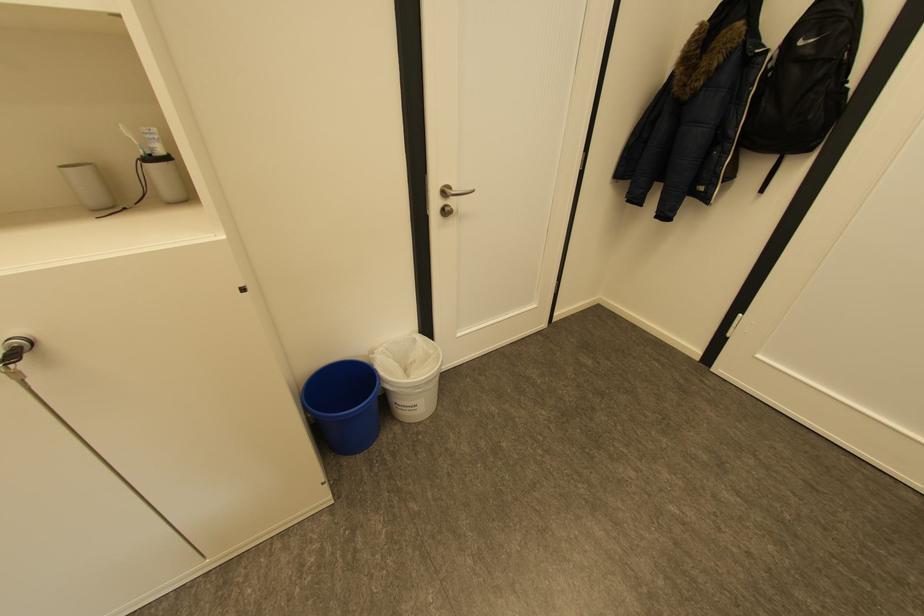
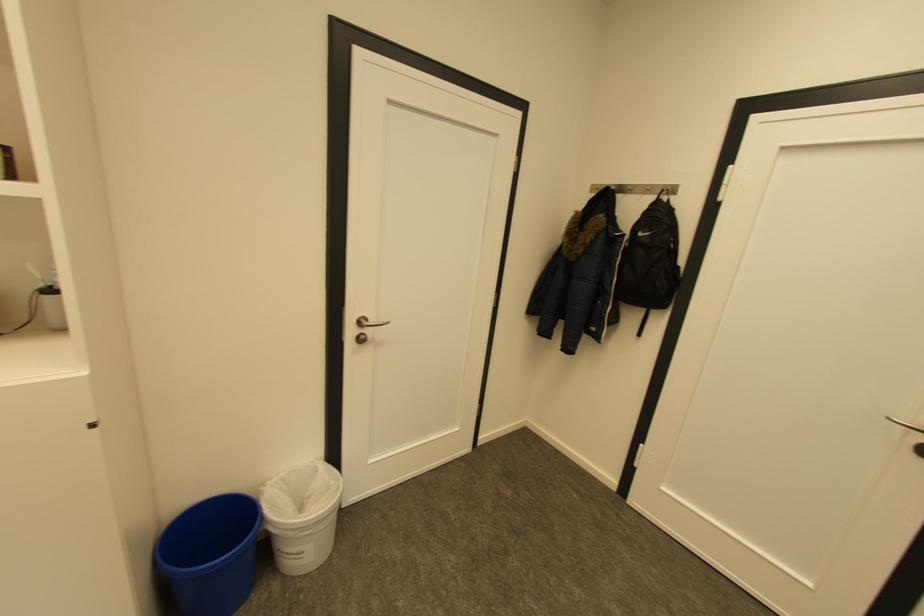
In the second image, find the point that corresponds to [451,192] in the first image.

(367, 323)